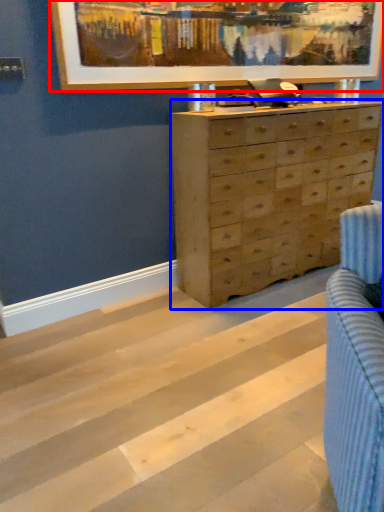
Question: Which object is closer to the camera taking this photo, picture frame (highlighted by a red box) or chest of drawers (highlighted by a blue box)?

Choices:
 (A) picture frame
 (B) chest of drawers

Answer: (A)